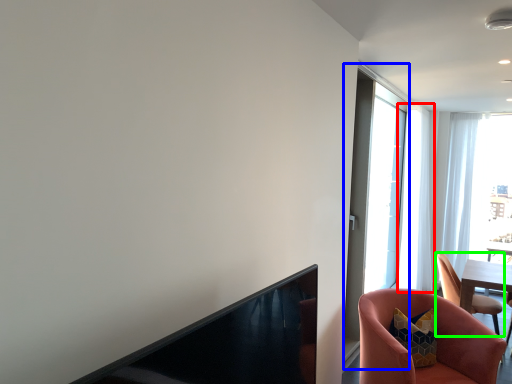
Question: Which object is the closest to the curtain (highlighted by a red box)? Choose among these: screen door (highlighted by a blue box) or chair (highlighted by a green box).

Choices:
 (A) screen door
 (B) chair

Answer: (A)